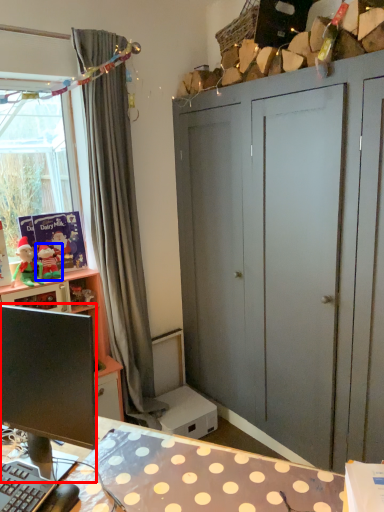
Question: Which of the following is the closest to the observer, computer monitor (highlighted by a red box) or toy (highlighted by a blue box)?

Choices:
 (A) computer monitor
 (B) toy

Answer: (A)